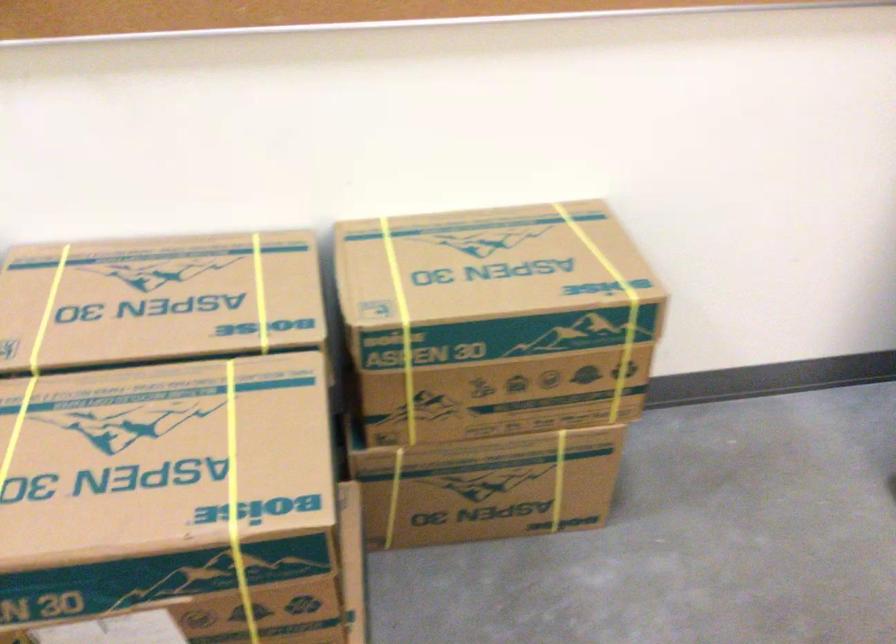
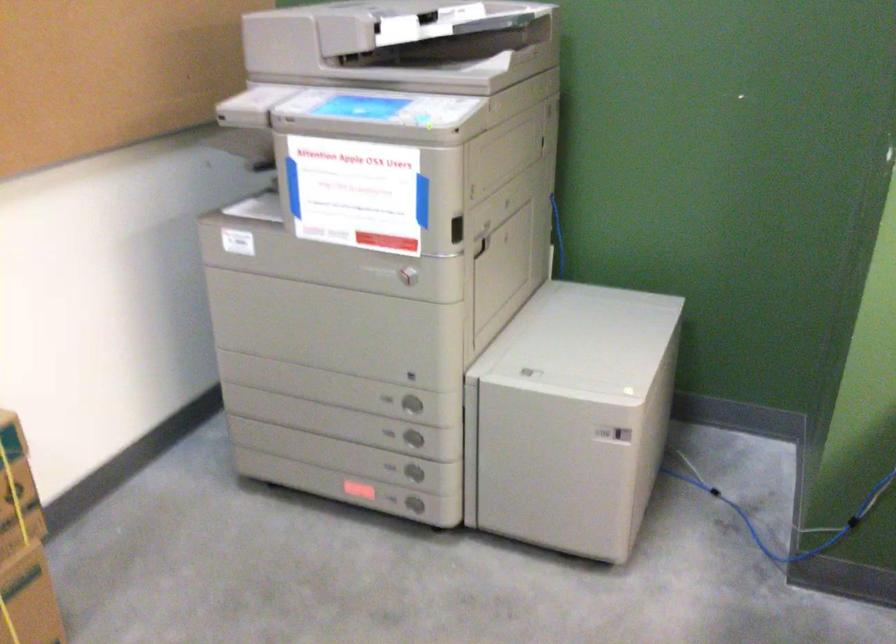
Question: The first image is from the beginning of the video and the second image is from the end. How did the camera likely rotate when shooting the video?

Choices:
 (A) Left
 (B) Right
 (C) Up
 (D) Down

Answer: (B)